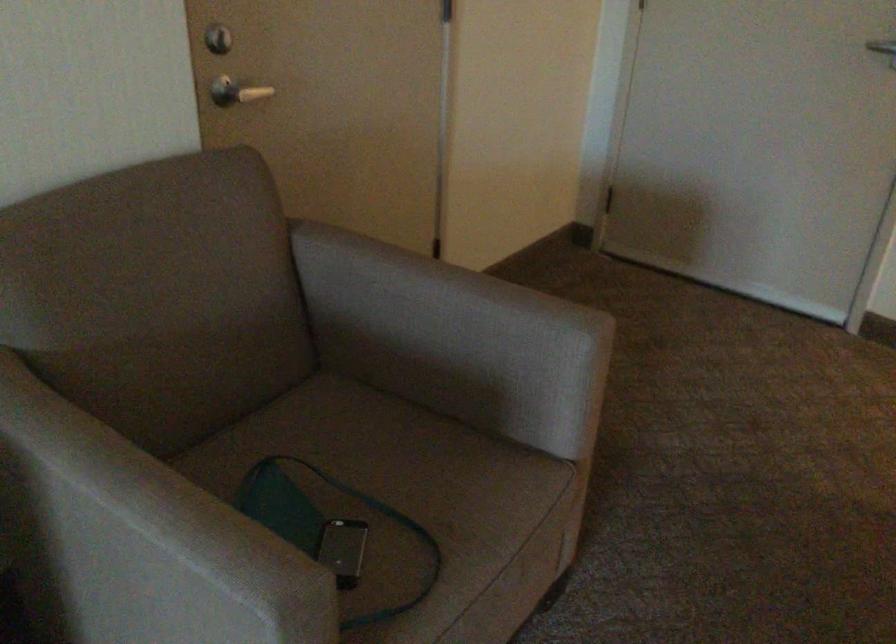
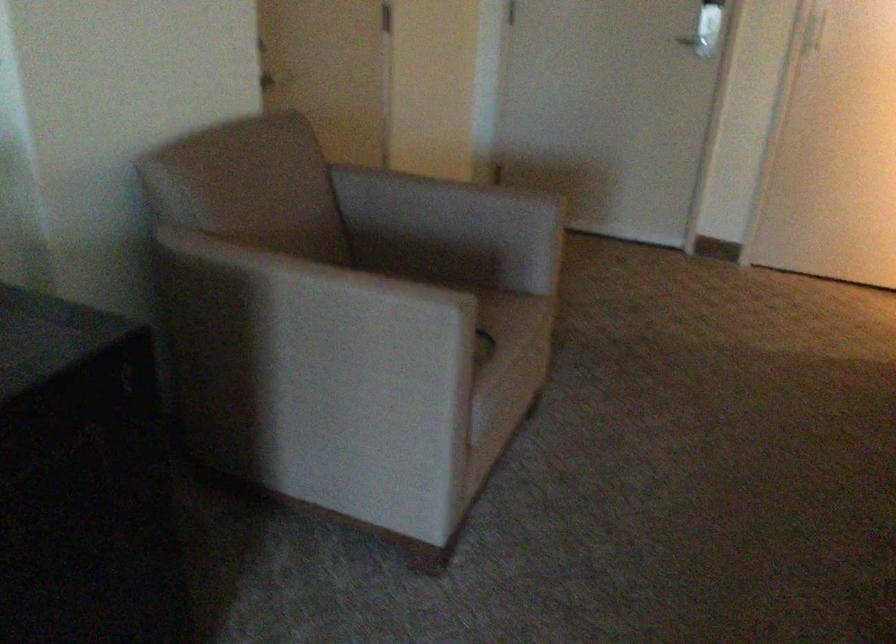
Question: I am providing you with two images of the same scene from different viewpoints. Please identify which objects are invisible in image2.

Choices:
 (A) pitcher
 (B) chair armrest
 (C) chair sitting surface
 (D) metal door handle

Answer: (C)